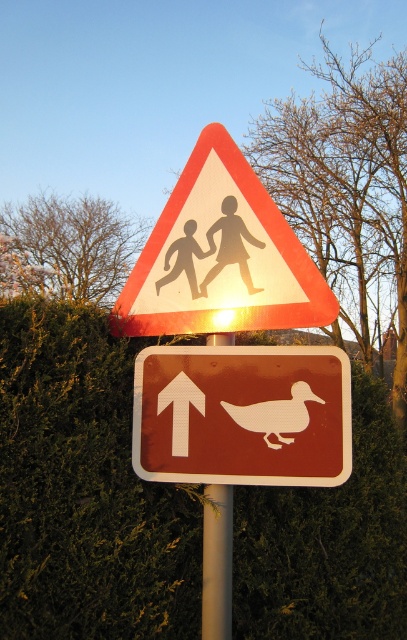
Question: Does white glossy pedestrian crossing sign at upper center come in front of metallic silver pole at center?

Choices:
 (A) yes
 (B) no

Answer: (A)

Question: Which object appears farthest from the camera in this image?

Choices:
 (A) metallic silver pole at center
 (B) green leafy hedge at center

Answer: (A)

Question: Is white glossy pedestrian crossing sign at upper center closer to camera compared to metallic silver pole at center?

Choices:
 (A) no
 (B) yes

Answer: (B)

Question: Is brown matte duck at center positioned at the back of white glossy pedestrian crossing sign at upper center?

Choices:
 (A) yes
 (B) no

Answer: (A)

Question: Which object appears closest to the camera in this image?

Choices:
 (A) metallic silver pole at center
 (B) green leafy hedge at center

Answer: (B)

Question: Estimate the real-world distances between objects in this image. Which object is closer to the metallic silver pole at center?

Choices:
 (A) green leafy hedge at center
 (B) white glossy pedestrian crossing sign at upper center
 (C) brown matte duck at center

Answer: (C)